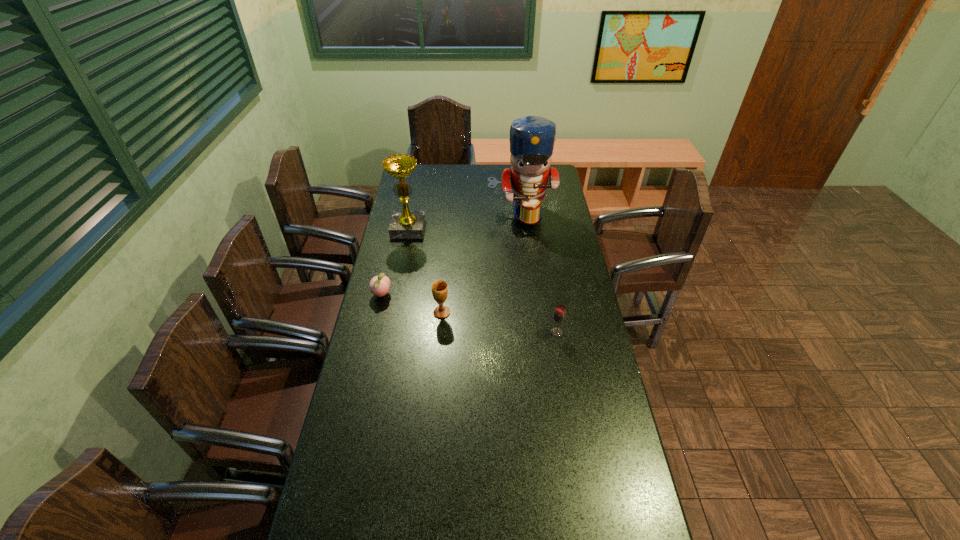
Where is `blank region between the award and the nutcracker`? Image resolution: width=960 pixels, height=540 pixels. blank region between the award and the nutcracker is located at coordinates (465, 221).

At what (x,y) coordinates should I click in order to perform the action: click on free space between the nutcracker and the third farthest object. Please return your answer as a coordinate pair (x, y). Looking at the image, I should click on (451, 254).

Locate an element on the screen. free space between the award and the fourth farthest object is located at coordinates (425, 271).

Locate an element on the screen. The width and height of the screenshot is (960, 540). vacant point located between the second tallest object and the third object from right to left is located at coordinates (425, 271).

The width and height of the screenshot is (960, 540). What are the coordinates of `vacant space in between the glass drink container and the peach` in the screenshot? It's located at (469, 314).

Find the location of a particular element. empty space between the chalice and the second tallest object is located at coordinates (425, 271).

Locate which object is the second closest to the fourth farthest object. Please provide its 2D coordinates. Your answer should be formatted as a tuple, i.e. [(x, y)], where the tuple contains the x and y coordinates of a point satisfying the conditions above.

[(559, 315)]

At what (x,y) coordinates should I click in order to perform the action: click on the third closest object relative to the nutcracker. Please return your answer as a coordinate pair (x, y). Looking at the image, I should click on (379, 285).

At what (x,y) coordinates should I click in order to perform the action: click on vacant space that satisfies the following two spatial constraints: 1. on the front-facing side of the glass drink container; 2. on the left side of the award. Please return your answer as a coordinate pair (x, y). Image resolution: width=960 pixels, height=540 pixels. Looking at the image, I should click on point(388,333).

You are a GUI agent. You are given a task and a screenshot of the screen. Output one action in this format:
    pyautogui.click(x=<x>, y=<y>)
    Task: Click on the free space that satisfies the following two spatial constraints: 1. on the front-facing side of the nearest object; 2. on the left side of the tallest object
    The image size is (960, 540).
    Given the screenshot: What is the action you would take?
    pyautogui.click(x=535, y=333)